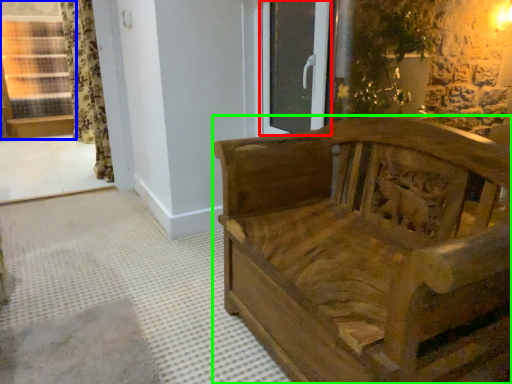
Question: Based on their relative distances, which object is farther from glass door (highlighted by a red box)? Choose from window (highlighted by a blue box) and furniture (highlighted by a green box).

Choices:
 (A) window
 (B) furniture

Answer: (A)